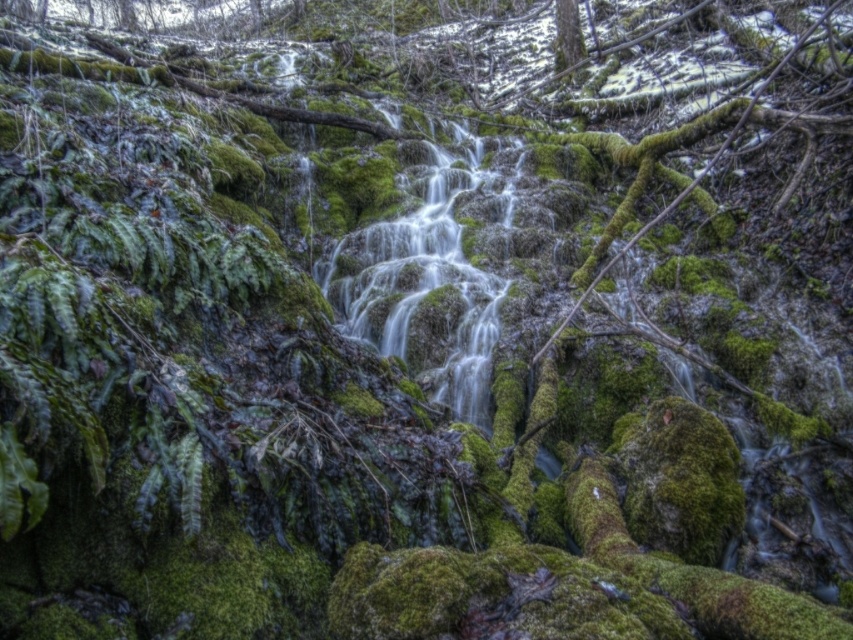
Question: Can you confirm if green mossy stream at center is smaller than green mossy tree at upper center?

Choices:
 (A) no
 (B) yes

Answer: (B)

Question: Among these objects, which one is farthest from the camera?

Choices:
 (A) green mossy tree at upper center
 (B) green mossy stream at center

Answer: (A)

Question: Among these objects, which one is nearest to the camera?

Choices:
 (A) green mossy tree at upper center
 (B) green mossy stream at center

Answer: (B)

Question: Is green mossy stream at center smaller than green mossy tree at upper center?

Choices:
 (A) yes
 (B) no

Answer: (A)

Question: Which object is farther from the camera taking this photo?

Choices:
 (A) green mossy tree at upper center
 (B) green mossy stream at center

Answer: (A)

Question: Is green mossy stream at center to the right of green mossy tree at upper center from the viewer's perspective?

Choices:
 (A) no
 (B) yes

Answer: (A)